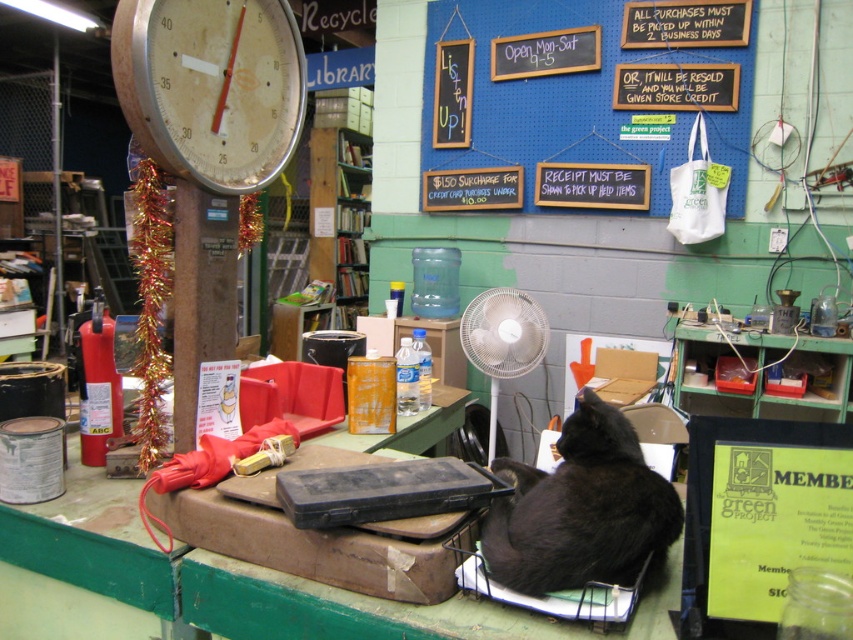
Question: Does blue pegboard at upper center appear on the left side of black fur cat at lower right?

Choices:
 (A) yes
 (B) no

Answer: (B)

Question: Is blue pegboard at upper center bigger than black fur cat at lower right?

Choices:
 (A) yes
 (B) no

Answer: (A)

Question: Which object is the farthest from the black fur cat at lower right?

Choices:
 (A) dirty white scale at upper left
 (B) blue pegboard at upper center

Answer: (B)

Question: Which point is closer to the camera taking this photo?

Choices:
 (A) (271, 48)
 (B) (492, 100)
 (C) (569, 468)

Answer: (C)

Question: Is blue pegboard at upper center bigger than dirty white scale at upper left?

Choices:
 (A) yes
 (B) no

Answer: (A)

Question: Which object appears farthest from the camera in this image?

Choices:
 (A) blue pegboard at upper center
 (B) black fur cat at lower right
 (C) dirty white scale at upper left

Answer: (A)